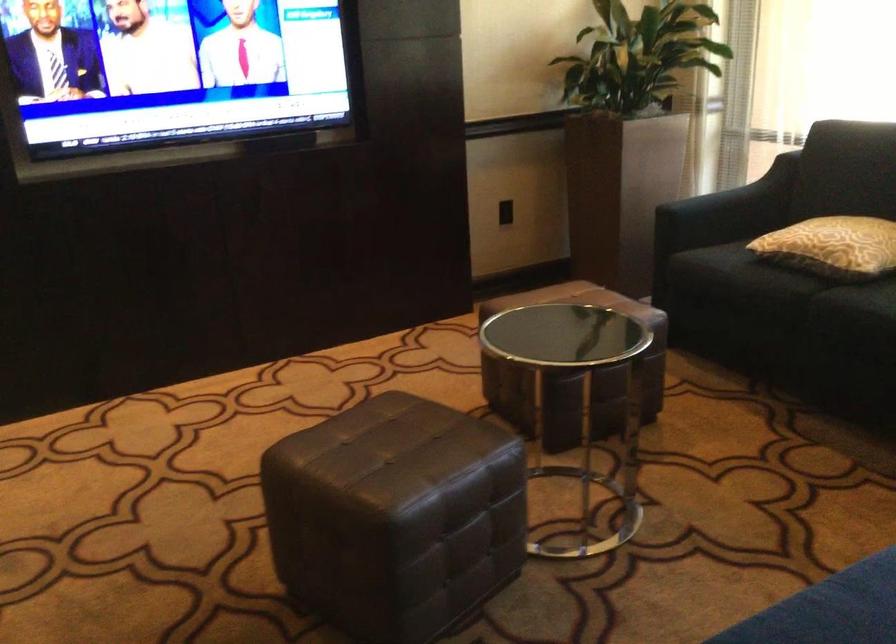
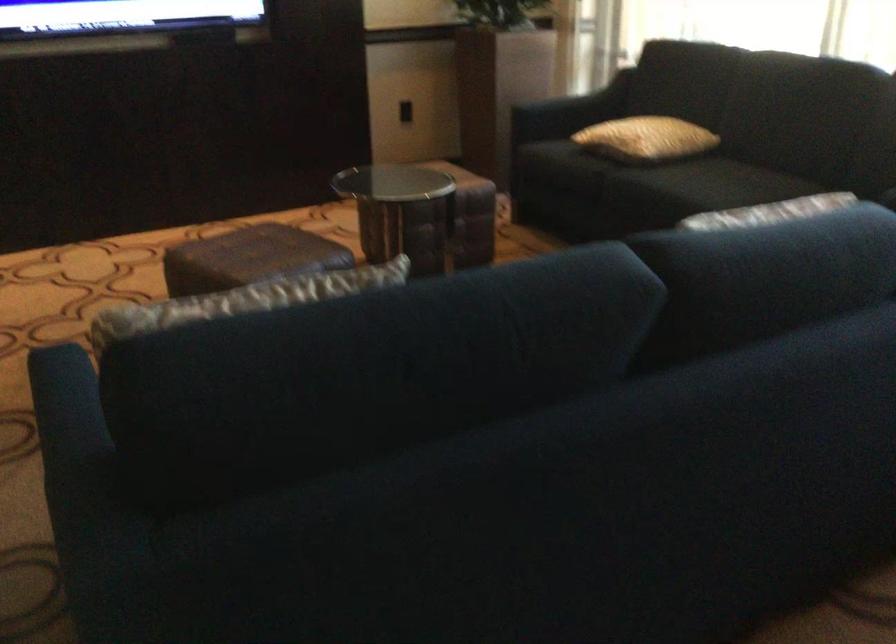
The images are taken continuously from a first-person perspective. In which direction are you moving?

The cameraman moved toward right, backward.